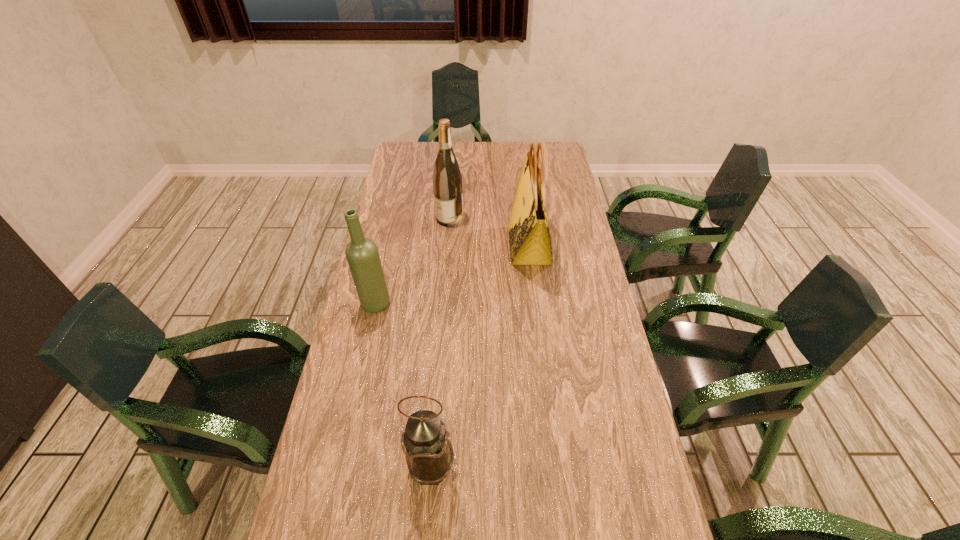
Identify the location of free spot between the oil lamp and the rightmost object. (480, 356).

Locate an element on the screen. This screenshot has height=540, width=960. vacant area that lies between the tote bag and the nearest object is located at coordinates (480, 356).

This screenshot has height=540, width=960. In order to click on empty space between the rightmost object and the farther wine bottle in this screenshot , I will do `click(490, 232)`.

Where is `blank region between the leftmost object and the oil lamp`? blank region between the leftmost object and the oil lamp is located at coordinates (403, 386).

Identify which object is the second closest to the rightmost object. Please provide its 2D coordinates. Your answer should be formatted as a tuple, i.e. [(x, y)], where the tuple contains the x and y coordinates of a point satisfying the conditions above.

[(362, 255)]

Identify which object is the third nearest to the leftmost object. Please provide its 2D coordinates. Your answer should be formatted as a tuple, i.e. [(x, y)], where the tuple contains the x and y coordinates of a point satisfying the conditions above.

[(429, 454)]

The height and width of the screenshot is (540, 960). What are the coordinates of `vacant space that satisfies the following two spatial constraints: 1. on the front side of the right wine bottle; 2. on the left side of the nearest object` in the screenshot? It's located at (430, 467).

At what (x,y) coordinates should I click in order to perform the action: click on free space that satisfies the following two spatial constraints: 1. on the front-facing side of the tote bag; 2. on the front side of the nearest object. Please return your answer as a coordinate pair (x, y). Looking at the image, I should click on (556, 467).

Where is `vacant space that satisfies the following two spatial constraints: 1. on the front side of the oil lamp; 2. on the left side of the farther wine bottle`? The height and width of the screenshot is (540, 960). vacant space that satisfies the following two spatial constraints: 1. on the front side of the oil lamp; 2. on the left side of the farther wine bottle is located at coordinates (430, 467).

The height and width of the screenshot is (540, 960). In order to click on free spot that satisfies the following two spatial constraints: 1. on the front-facing side of the tote bag; 2. on the front side of the leftmost object in this screenshot , I will do `click(537, 304)`.